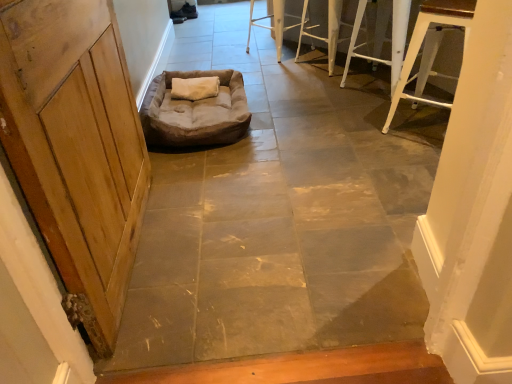
Question: Should I look upward or downward to see brown suede dog bed at center?

Choices:
 (A) up
 (B) down

Answer: (A)

Question: Considering the relative sizes of wooden door at left and white metal stool at upper center, placed as the 1th furniture when sorted from back to front, in the image provided, is wooden door at left thinner than white metal stool at upper center, placed as the 1th furniture when sorted from back to front,?

Choices:
 (A) no
 (B) yes

Answer: (B)

Question: Does wooden door at left have a greater height compared to white metal stool at upper center, marked as the 4th furniture in a front-to-back arrangement?

Choices:
 (A) no
 (B) yes

Answer: (B)

Question: Considering the relative positions of wooden door at left and white metal stool at upper center, placed as the 1th furniture when sorted from back to front, in the image provided, is wooden door at left to the right of white metal stool at upper center, placed as the 1th furniture when sorted from back to front, from the viewer's perspective?

Choices:
 (A) no
 (B) yes

Answer: (A)

Question: Is the position of wooden door at left more distant than that of white metal stool at upper center, marked as the 4th furniture in a front-to-back arrangement?

Choices:
 (A) no
 (B) yes

Answer: (A)

Question: From the image's perspective, is wooden door at left beneath white metal stool at upper center, marked as the 4th furniture in a front-to-back arrangement?

Choices:
 (A) yes
 (B) no

Answer: (A)

Question: Does wooden door at left have a smaller size compared to white metal stool at upper center, placed as the 1th furniture when sorted from back to front?

Choices:
 (A) yes
 (B) no

Answer: (B)

Question: Considering the relative sizes of white metal stool at upper right, the third furniture from the back, and brown suede dog bed at center in the image provided, is white metal stool at upper right, the third furniture from the back, shorter than brown suede dog bed at center?

Choices:
 (A) no
 (B) yes

Answer: (A)

Question: Does white metal stool at upper right, the third furniture from the back, have a larger size compared to brown suede dog bed at center?

Choices:
 (A) no
 (B) yes

Answer: (A)

Question: Can you confirm if white metal stool at upper right, the third furniture from the back, is taller than brown suede dog bed at center?

Choices:
 (A) yes
 (B) no

Answer: (A)

Question: Considering the relative positions of white metal stool at upper right, the third furniture from the back, and brown suede dog bed at center in the image provided, is white metal stool at upper right, the third furniture from the back, behind brown suede dog bed at center?

Choices:
 (A) no
 (B) yes

Answer: (B)

Question: From a real-world perspective, is white metal stool at upper right, the third furniture from the back, on brown suede dog bed at center?

Choices:
 (A) no
 (B) yes

Answer: (B)

Question: Is white metal stool at upper right, the third furniture from the back, located outside brown suede dog bed at center?

Choices:
 (A) yes
 (B) no

Answer: (A)

Question: Is brown suede dog bed at center facing away from white metal stool at upper right, acting as the fourth furniture starting from the back?

Choices:
 (A) no
 (B) yes

Answer: (A)